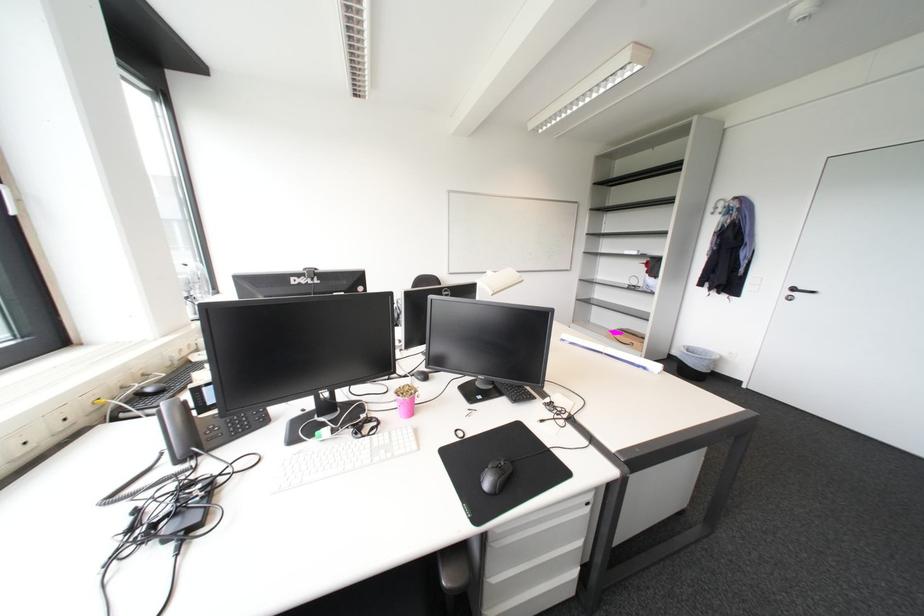
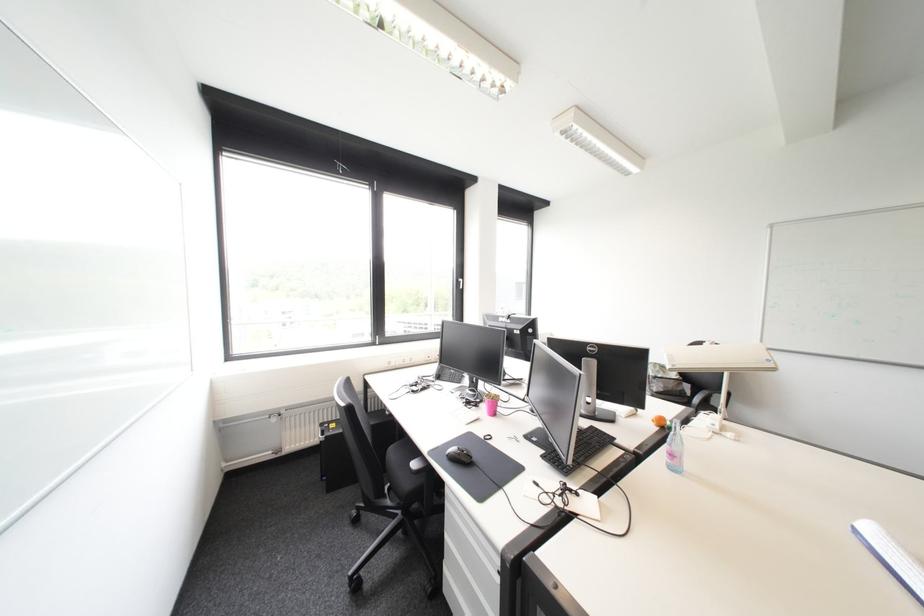
Locate, in the second image, the point that corresponds to (x=517, y=475) in the first image.

(468, 458)